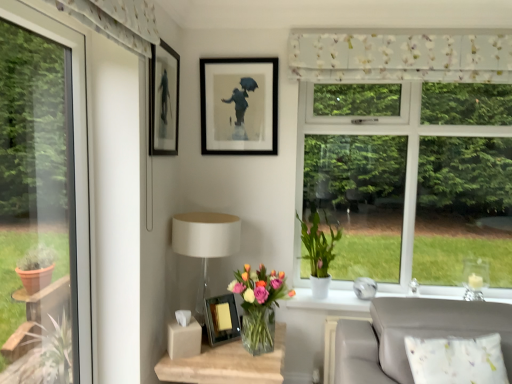
What do you see at coordinates (259, 305) in the screenshot? The width and height of the screenshot is (512, 384). I see `translucent glass vase at lower center, the 2th houseplant when ordered from right to left` at bounding box center [259, 305].

Find the location of a particular element. Image resolution: width=512 pixels, height=384 pixels. white matte pot at window, arranged as the 1th houseplant when viewed from the back is located at coordinates (318, 253).

Find the location of a particular element. white fabric couch at lower right is located at coordinates click(x=412, y=335).

What is the approximate height of metallic silver picture frame at center, arranged as the 1th picture frame when ordered from the bottom?

9.53 inches.

The width and height of the screenshot is (512, 384). What do you see at coordinates (221, 319) in the screenshot?
I see `metallic silver picture frame at center, arranged as the 1th picture frame when ordered from the bottom` at bounding box center [221, 319].

What is the approximate height of matte black picture frame at upper left, which is the 2th picture frame from bottom to top?

The height of matte black picture frame at upper left, which is the 2th picture frame from bottom to top, is 22.59 inches.

At what (x,y) coordinates should I click in order to perform the action: click on translucent glass vase at lower center, the 2th houseplant when ordered from right to left. Please return your answer as a coordinate pair (x, y). Image resolution: width=512 pixels, height=384 pixels. Looking at the image, I should click on (259, 305).

Is translucent glass vase at lower center, the second houseplant when ordered from back to front, not close to matte white table lamp at center?

Actually, translucent glass vase at lower center, the second houseplant when ordered from back to front, and matte white table lamp at center are a little close together.

Is translucent glass vase at lower center, the second houseplant when ordered from back to front, to the right of matte white table lamp at center from the viewer's perspective?

Yes.

How many degrees apart are the facing directions of translucent glass vase at lower center, arranged as the 1th houseplant when viewed from the front, and matte white table lamp at center?

0.00071 degrees.

Which of these two, white matte pot at window, arranged as the 1th houseplant when viewed from the back, or metallic silver picture frame at center, arranged as the third picture frame when viewed from the top, is smaller?

With smaller size is metallic silver picture frame at center, arranged as the third picture frame when viewed from the top.

From the picture: Is white matte pot at window, which ranks as the second houseplant in front-to-back order, aimed at metallic silver picture frame at center, arranged as the third picture frame when viewed from the top?

No, white matte pot at window, which ranks as the second houseplant in front-to-back order, is not facing towards metallic silver picture frame at center, arranged as the third picture frame when viewed from the top.

Is white matte pot at window, which ranks as the second houseplant in front-to-back order, to the left of metallic silver picture frame at center, arranged as the 1th picture frame when ordered from the bottom, from the viewer's perspective?

In fact, white matte pot at window, which ranks as the second houseplant in front-to-back order, is to the right of metallic silver picture frame at center, arranged as the 1th picture frame when ordered from the bottom.

From a real-world perspective, is white matte pot at window, which ranks as the second houseplant in front-to-back order, over metallic silver picture frame at center, arranged as the 1th picture frame when ordered from the bottom?

Yes, from a real-world perspective, white matte pot at window, which ranks as the second houseplant in front-to-back order, is above metallic silver picture frame at center, arranged as the 1th picture frame when ordered from the bottom.

Which is behind, point (271, 272) or point (393, 361)?

The point (271, 272) is farther from the camera.

From a real-world perspective, is translucent glass vase at lower center, arranged as the 1th houseplant when viewed from the front, on white fabric couch at lower right?

Correct, in the physical world, translucent glass vase at lower center, arranged as the 1th houseplant when viewed from the front, is higher than white fabric couch at lower right.

Between translucent glass vase at lower center, which is the first houseplant from left to right, and white fabric couch at lower right, which one has smaller width?

Thinner between the two is white fabric couch at lower right.

Is translucent glass vase at lower center, arranged as the 1th houseplant when viewed from the front, facing away from white fabric couch at lower right?

translucent glass vase at lower center, arranged as the 1th houseplant when viewed from the front, does not have its back to white fabric couch at lower right.

Is white matte pot at window, the 2th houseplant from the left, far away from matte black frame at upper center, the 3th picture frame ordered from the bottom?

No, there isn't a large distance between white matte pot at window, the 2th houseplant from the left, and matte black frame at upper center, the 3th picture frame ordered from the bottom.

From the image's perspective, count 2nd picture frames upward from the white matte pot at window, arranged as the first houseplant when viewed from the right, and point to it. Please provide its 2D coordinates.

[(239, 106)]

How many degrees apart are the facing directions of white matte pot at window, arranged as the first houseplant when viewed from the right, and matte black frame at upper center, placed as the first picture frame when sorted from top to bottom?

0.79 degrees separate the facing orientations of white matte pot at window, arranged as the first houseplant when viewed from the right, and matte black frame at upper center, placed as the first picture frame when sorted from top to bottom.

Which object is more forward, translucent glass vase at lower center or translucent glass vase at lower center, arranged as the 1th houseplant when viewed from the front?

translucent glass vase at lower center is more forward.

Is translucent glass vase at lower center facing towards translucent glass vase at lower center, the second houseplant when ordered from back to front?

No, translucent glass vase at lower center does not turn towards translucent glass vase at lower center, the second houseplant when ordered from back to front.

Can you confirm if translucent glass vase at lower center is taller than translucent glass vase at lower center, the second houseplant when ordered from back to front?

Yes.

From the image's perspective, starting from the floral fabric curtain at upper center, which picture frame is the 2nd one below? Please provide its 2D coordinates.

[(163, 100)]

Considering the relative positions of floral fabric curtain at upper center and matte black picture frame at upper left, which is the second picture frame in top-to-bottom order, in the image provided, is floral fabric curtain at upper center to the left of matte black picture frame at upper left, which is the second picture frame in top-to-bottom order, from the viewer's perspective?

Answer: No, floral fabric curtain at upper center is not to the left of matte black picture frame at upper left, which is the second picture frame in top-to-bottom order.

Does point (380, 54) lie behind point (179, 61)?

No, (380, 54) is closer to viewer.

From the image's perspective, is floral fabric curtain at upper center over matte black picture frame at upper left, which is the second picture frame in top-to-bottom order?

A: Yes, from the image's perspective, floral fabric curtain at upper center is on top of matte black picture frame at upper left, which is the second picture frame in top-to-bottom order.

Looking at this image, considering the positions of objects white matte pot at window, which ranks as the second houseplant in front-to-back order, and floral fabric curtain at upper center in the image provided, who is behind, white matte pot at window, which ranks as the second houseplant in front-to-back order, or floral fabric curtain at upper center?

Positioned behind is white matte pot at window, which ranks as the second houseplant in front-to-back order.

Considering the sizes of objects white matte pot at window, which ranks as the second houseplant in front-to-back order, and floral fabric curtain at upper center in the image provided, who is wider, white matte pot at window, which ranks as the second houseplant in front-to-back order, or floral fabric curtain at upper center?

With larger width is white matte pot at window, which ranks as the second houseplant in front-to-back order.

Could you tell me if white matte pot at window, arranged as the first houseplant when viewed from the right, is facing floral fabric curtain at upper center?

No, white matte pot at window, arranged as the first houseplant when viewed from the right, is not aimed at floral fabric curtain at upper center.

Who is shorter, white matte pot at window, arranged as the 1th houseplant when viewed from the back, or floral fabric curtain at upper center?

Standing shorter between the two is floral fabric curtain at upper center.

Image resolution: width=512 pixels, height=384 pixels. Identify the location of table lamp above the translucent glass vase at lower center, arranged as the 1th houseplant when viewed from the front (from the image's perspective). (205, 243).

This screenshot has height=384, width=512. What are the coordinates of `picture frame below the white matte pot at window, the 2th houseplant from the left (from the image's perspective)` in the screenshot? It's located at (221, 319).

Estimate the real-world distances between objects in this image. Which object is further from floral fabric curtain at upper center, matte white table lamp at center or translucent glass vase at lower center, the second houseplant when ordered from back to front?

translucent glass vase at lower center, the second houseplant when ordered from back to front, lies further to floral fabric curtain at upper center than the other object.

Estimate the real-world distances between objects in this image. Which object is closer to translucent glass vase at lower center, which is the first houseplant from left to right, matte white table lamp at center or matte black picture frame at upper left, which is the second picture frame in top-to-bottom order?

Based on the image, matte white table lamp at center appears to be nearer to translucent glass vase at lower center, which is the first houseplant from left to right.

Considering their positions, is matte black picture frame at upper left, which is the 2th picture frame from bottom to top, positioned further to metallic silver picture frame at center, arranged as the 1th picture frame when ordered from the bottom, than translucent glass vase at lower center?

matte black picture frame at upper left, which is the 2th picture frame from bottom to top, is further to metallic silver picture frame at center, arranged as the 1th picture frame when ordered from the bottom.

Looking at the image, which one is located closer to matte black frame at upper center, the 3th picture frame ordered from the bottom, translucent glass vase at lower center or matte white table lamp at center?

matte white table lamp at center is positioned closer to the anchor matte black frame at upper center, the 3th picture frame ordered from the bottom.

Consider the image. Which object lies further to the anchor point matte black frame at upper center, the 3th picture frame ordered from the bottom, white matte pot at window, which ranks as the second houseplant in front-to-back order, or matte white table lamp at center?

The object further to matte black frame at upper center, the 3th picture frame ordered from the bottom, is white matte pot at window, which ranks as the second houseplant in front-to-back order.

Looking at the image, which one is located further to matte black picture frame at upper left, which is the second picture frame in top-to-bottom order, matte white table lamp at center or floral fabric curtain at upper center?

floral fabric curtain at upper center is further to matte black picture frame at upper left, which is the second picture frame in top-to-bottom order.

Estimate the real-world distances between objects in this image. Which object is further from white fabric couch at lower right, matte white table lamp at center or floral fabric curtain at upper center?

A: floral fabric curtain at upper center lies further to white fabric couch at lower right than the other object.

When comparing their distances from matte black picture frame at upper left, which is the 2th picture frame from bottom to top, does translucent glass vase at lower center or white matte pot at window, arranged as the 1th houseplant when viewed from the back, seem further?

translucent glass vase at lower center lies further to matte black picture frame at upper left, which is the 2th picture frame from bottom to top, than the other object.

Find the location of `houseplant between floral fabric curtain at upper center and matte white table lamp at center vertically`. houseplant between floral fabric curtain at upper center and matte white table lamp at center vertically is located at coordinates (318, 253).

Find the location of `houseplant between white matte pot at window, which ranks as the second houseplant in front-to-back order, and translucent glass vase at lower center in the up-down direction`. houseplant between white matte pot at window, which ranks as the second houseplant in front-to-back order, and translucent glass vase at lower center in the up-down direction is located at coordinates (x=259, y=305).

Find the location of a particular element. This screenshot has width=512, height=384. houseplant between matte black frame at upper center, placed as the first picture frame when sorted from top to bottom, and translucent glass vase at lower center, arranged as the 1th houseplant when viewed from the front, from top to bottom is located at coordinates (318, 253).

Where is `table lamp between matte black picture frame at upper left, which is the 2th picture frame from bottom to top, and translucent glass vase at lower center, in the vertical direction`? The width and height of the screenshot is (512, 384). table lamp between matte black picture frame at upper left, which is the 2th picture frame from bottom to top, and translucent glass vase at lower center, in the vertical direction is located at coordinates (205, 243).